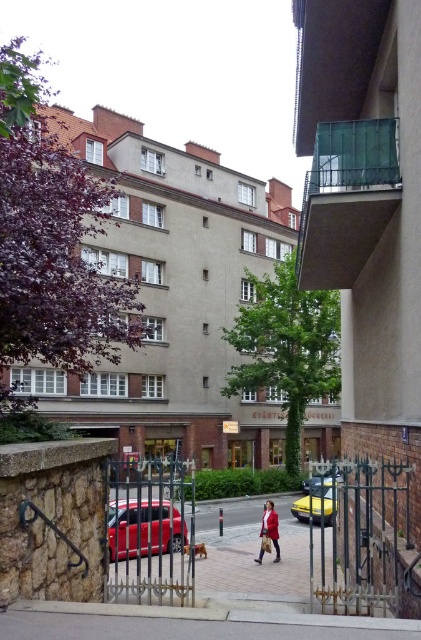
You are standing at point (x=252, y=554) in the image. What is the object you are currently standing on?

You are standing on the paved stone pavement at center.